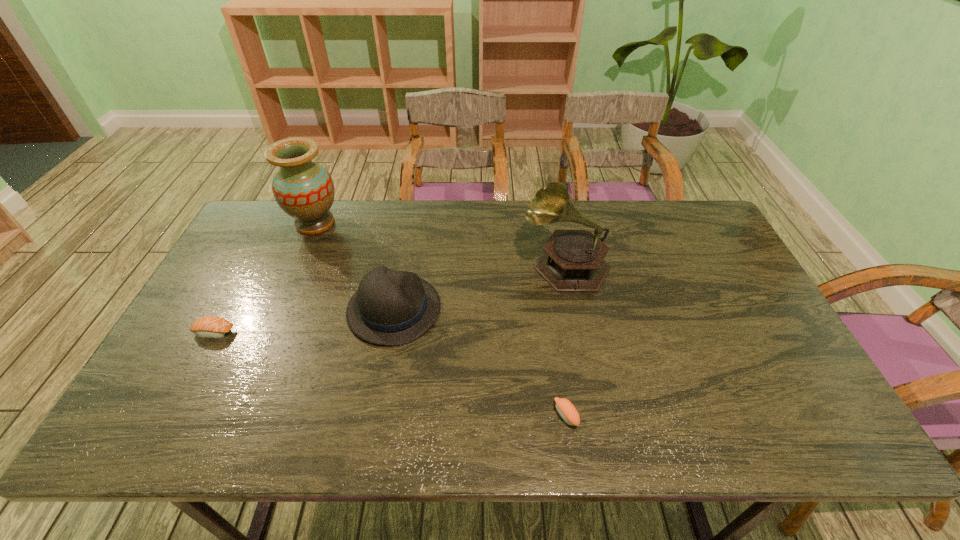
Where is `free space located 0.190m on the horn direction of the phonograph record`? This screenshot has width=960, height=540. free space located 0.190m on the horn direction of the phonograph record is located at coordinates (462, 264).

You are a GUI agent. You are given a task and a screenshot of the screen. Output one action in this format:
    pyautogui.click(x=<x>, y=<y>)
    Task: Click on the vacant point located 0.070m on the horn direction of the phonograph record
    The width and height of the screenshot is (960, 540).
    Given the screenshot: What is the action you would take?
    pyautogui.click(x=500, y=264)

Find the location of a particular element. The width and height of the screenshot is (960, 540). vacant area situated 0.210m on the front-facing side of the third object from right to left is located at coordinates (516, 309).

Locate an element on the screen. The image size is (960, 540). blank area located on the front of the left sushi is located at coordinates (189, 379).

You are a GUI agent. You are given a task and a screenshot of the screen. Output one action in this format:
    pyautogui.click(x=<x>, y=<y>)
    Task: Click on the vacant region located on the right of the nearer sushi
    
    Given the screenshot: What is the action you would take?
    pyautogui.click(x=690, y=415)

Image resolution: width=960 pixels, height=540 pixels. What are the coordinates of `vase at the far edge` in the screenshot? It's located at (303, 189).

What are the coordinates of `phonograph record that is at the far edge` in the screenshot? It's located at (573, 260).

Image resolution: width=960 pixels, height=540 pixels. I want to click on object that is at the near edge, so click(x=565, y=408).

The width and height of the screenshot is (960, 540). I want to click on vase at the left edge, so [x=303, y=189].

The height and width of the screenshot is (540, 960). What are the coordinates of `sushi that is at the left edge` in the screenshot? It's located at (215, 327).